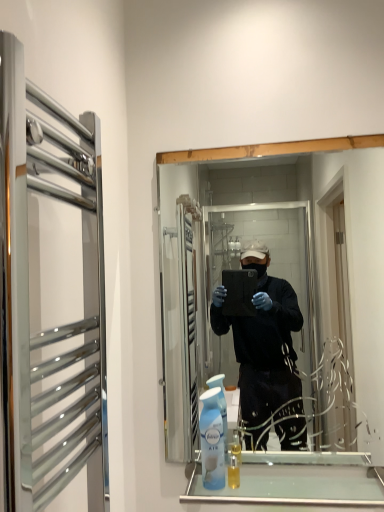
Question: Is clear glass cabinet at lower center at the right side of light blue plastic air freshener at lower center?

Choices:
 (A) no
 (B) yes

Answer: (B)

Question: Are clear glass cabinet at lower center and light blue plastic air freshener at lower center far apart?

Choices:
 (A) no
 (B) yes

Answer: (A)

Question: Would you say clear glass cabinet at lower center is outside light blue plastic air freshener at lower center?

Choices:
 (A) yes
 (B) no

Answer: (A)

Question: From a real-world perspective, is clear glass cabinet at lower center beneath light blue plastic air freshener at lower center?

Choices:
 (A) yes
 (B) no

Answer: (A)

Question: Considering the relative sizes of clear glass cabinet at lower center and light blue plastic air freshener at lower center in the image provided, is clear glass cabinet at lower center thinner than light blue plastic air freshener at lower center?

Choices:
 (A) no
 (B) yes

Answer: (A)

Question: Would you say light blue plastic air freshener at lower center is part of clear glass cabinet at lower center's contents?

Choices:
 (A) no
 (B) yes

Answer: (A)

Question: Can you confirm if clear glass cabinet at lower center is smaller than translucent plastic mouthwash at lower center?

Choices:
 (A) yes
 (B) no

Answer: (B)

Question: From the image's perspective, is clear glass cabinet at lower center beneath translucent plastic mouthwash at lower center?

Choices:
 (A) yes
 (B) no

Answer: (A)

Question: Is translucent plastic mouthwash at lower center completely or partially inside clear glass cabinet at lower center?

Choices:
 (A) no
 (B) yes

Answer: (A)

Question: Can you confirm if clear glass cabinet at lower center is thinner than translucent plastic mouthwash at lower center?

Choices:
 (A) yes
 (B) no

Answer: (B)

Question: Is clear glass cabinet at lower center not close to translucent plastic mouthwash at lower center?

Choices:
 (A) no
 (B) yes

Answer: (A)

Question: Can you confirm if clear glass cabinet at lower center is bigger than translucent plastic mouthwash at lower center?

Choices:
 (A) yes
 (B) no

Answer: (A)

Question: Are clear glass towel rack at left and light blue plastic air freshener at lower center located far from each other?

Choices:
 (A) no
 (B) yes

Answer: (A)